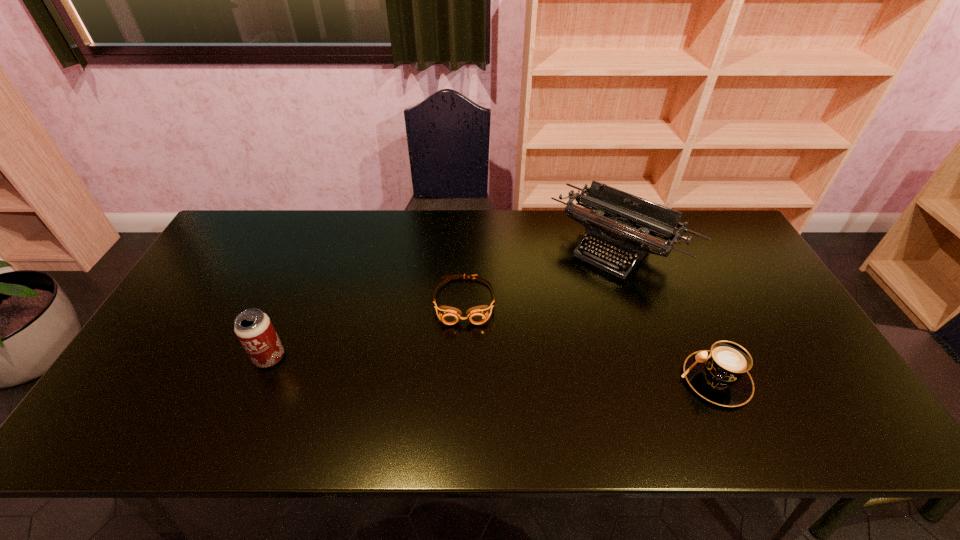
Where is `beer can`? The width and height of the screenshot is (960, 540). beer can is located at coordinates (254, 329).

The image size is (960, 540). Identify the location of cappuccino. (720, 375).

You are a GUI agent. You are given a task and a screenshot of the screen. Output one action in this format:
    pyautogui.click(x=<x>, y=<y>)
    Task: Click on the typewriter
    
    Given the screenshot: What is the action you would take?
    pyautogui.click(x=614, y=216)

Where is `the second object from left to right`? The width and height of the screenshot is (960, 540). the second object from left to right is located at coordinates (477, 315).

You are a GUI agent. You are given a task and a screenshot of the screen. Output one action in this format:
    pyautogui.click(x=<x>, y=<y>)
    Task: Click on the goggles
    This screenshot has width=960, height=540.
    Given the screenshot: What is the action you would take?
    pyautogui.click(x=477, y=315)

The image size is (960, 540). I want to click on free space located on the front of the leftmost object, so click(257, 388).

Where is `vacant area situated 0.260m on the left of the third tallest object`? Image resolution: width=960 pixels, height=540 pixels. vacant area situated 0.260m on the left of the third tallest object is located at coordinates (574, 380).

Locate an element on the screen. The image size is (960, 540). vacant space situated 0.130m on the typing side of the typewriter is located at coordinates (560, 302).

This screenshot has width=960, height=540. In order to click on free region located on the typing side of the typewriter in this screenshot , I will do `click(511, 355)`.

Find the location of a particular element. The width and height of the screenshot is (960, 540). blank space located 0.110m on the typing side of the typewriter is located at coordinates (564, 299).